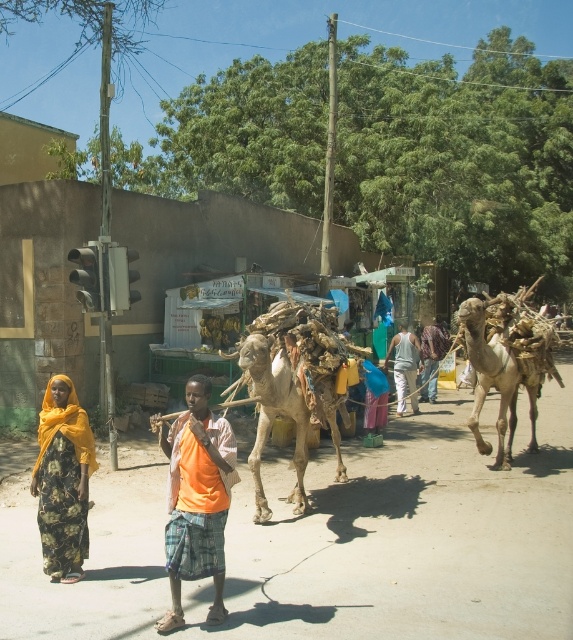
Question: Is brown textured camel at right in front of light gray cotton tank top at center?

Choices:
 (A) yes
 (B) no

Answer: (A)

Question: Based on their relative distances, which object is nearer to the light beige textured camel at center?

Choices:
 (A) brown textured camel at right
 (B) rustic wooden stick at center
 (C) yellow floral fabric at lower left

Answer: (C)

Question: Can you confirm if light gray cotton tank top at center is positioned below rustic wooden stick at center?

Choices:
 (A) no
 (B) yes

Answer: (B)

Question: Which of these objects is positioned closest to the light gray cotton tank top at center?

Choices:
 (A) orange fabric at center
 (B) brown textured camel at right

Answer: (B)

Question: Among these points, which one is nearest to the camera?

Choices:
 (A) pos(335,426)
 (B) pos(437,362)
 (C) pos(397,410)

Answer: (A)

Question: Can you confirm if orange fabric at center is bigger than yellow floral fabric at lower left?

Choices:
 (A) yes
 (B) no

Answer: (A)